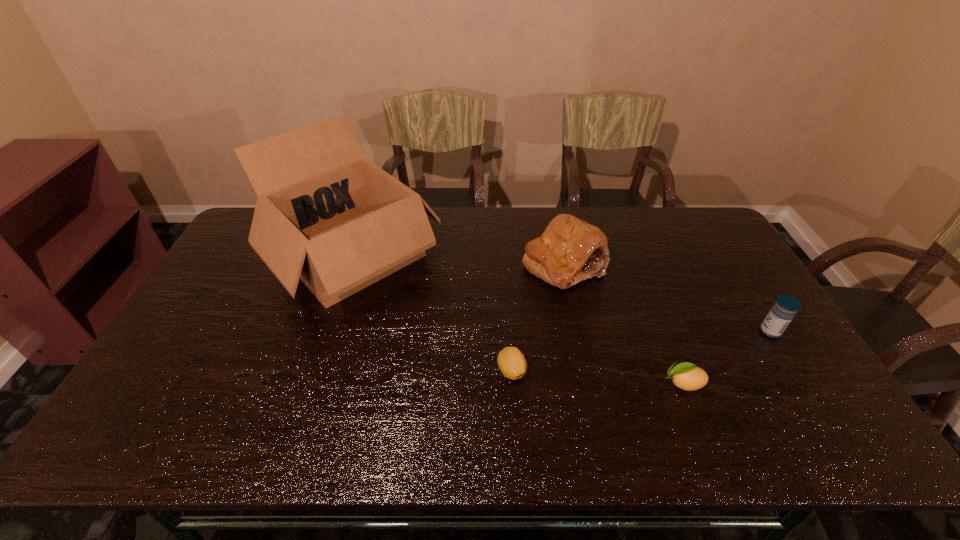
You are a GUI agent. You are given a task and a screenshot of the screen. Output one action in this format:
    pyautogui.click(x=<x>, y=<y>)
    Task: Click on the vacant space located 0.220m on the left of the rightmost object
    The height and width of the screenshot is (540, 960).
    Given the screenshot: What is the action you would take?
    pyautogui.click(x=682, y=331)

In order to click on vacant space located 0.300m with leaves positioned above the second object from right to left in this screenshot , I will do `click(543, 383)`.

The width and height of the screenshot is (960, 540). I want to click on vacant area situated 0.190m with leaves positioned above the second object from right to left, so click(587, 383).

At what (x,y) coordinates should I click in order to perform the action: click on vacant region located with leaves positioned above the second object from right to left. Please return your answer as a coordinate pair (x, y). This screenshot has width=960, height=540. Looking at the image, I should click on (551, 383).

Where is `free spot located at the stem end of the second object from left to right`? This screenshot has height=540, width=960. free spot located at the stem end of the second object from left to right is located at coordinates (516, 436).

The image size is (960, 540). In order to click on box located at the far edge in this screenshot , I will do `click(325, 214)`.

The width and height of the screenshot is (960, 540). I want to click on bread present at the far edge, so click(570, 250).

At what (x,y) coordinates should I click in order to perform the action: click on object positioned at the left edge. Please return your answer as a coordinate pair (x, y). Looking at the image, I should click on (325, 214).

Locate an element on the screen. object that is positioned at the right edge is located at coordinates (783, 311).

You are a GUI agent. You are given a task and a screenshot of the screen. Output one action in this format:
    pyautogui.click(x=<x>, y=<y>)
    Task: Click on the object that is at the far left corner
    This screenshot has height=540, width=960.
    Given the screenshot: What is the action you would take?
    pyautogui.click(x=325, y=214)